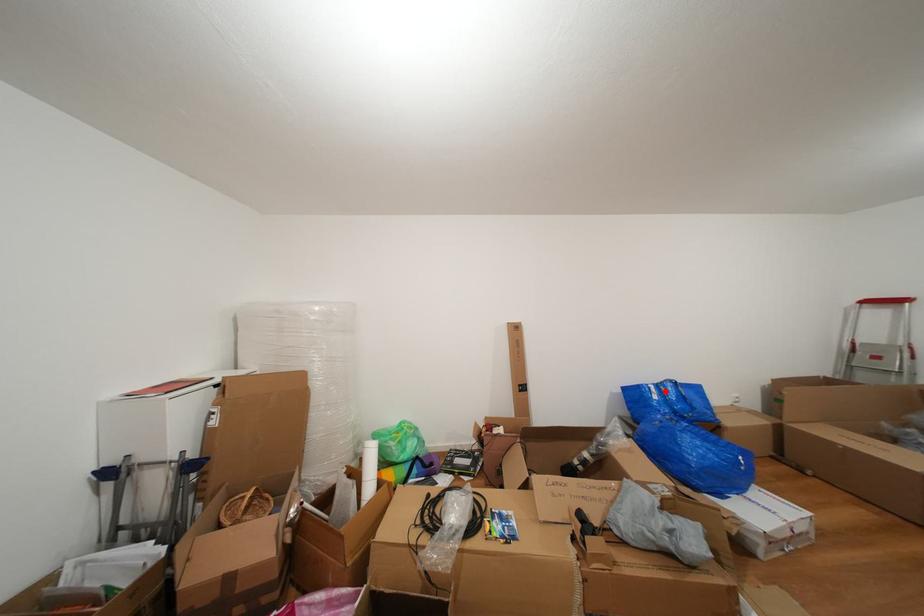
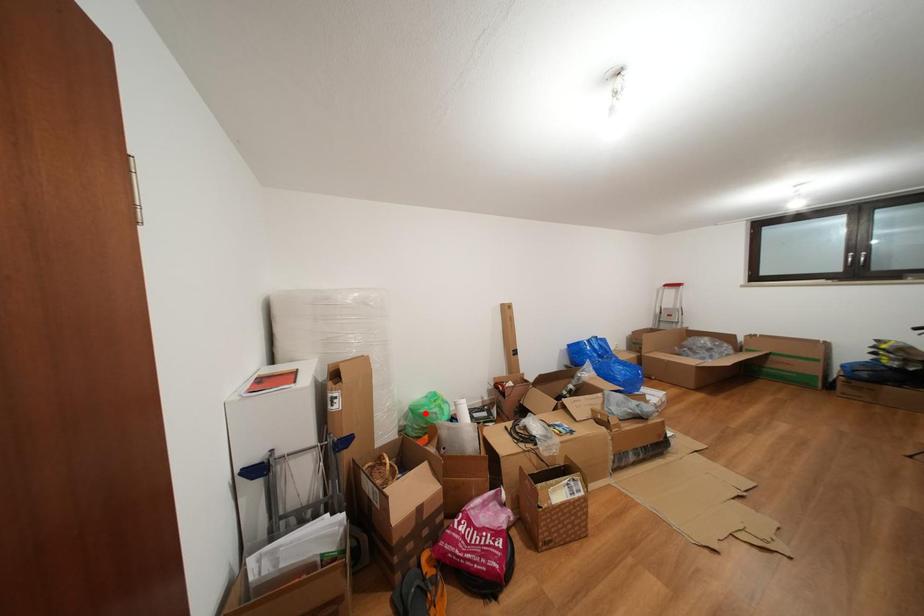
I am providing you with two images of the same scene from different viewpoints. A red point is marked on the first image and another point is marked on the second image. Is the red point in image1 aligned with the point shown in image2?

No